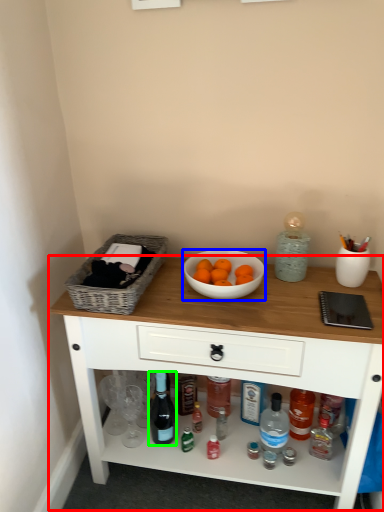
Question: Considering the real-world distances, which object is farthest from table (highlighted by a red box)? bowl (highlighted by a blue box) or bottle (highlighted by a green box)?

Choices:
 (A) bowl
 (B) bottle

Answer: (B)